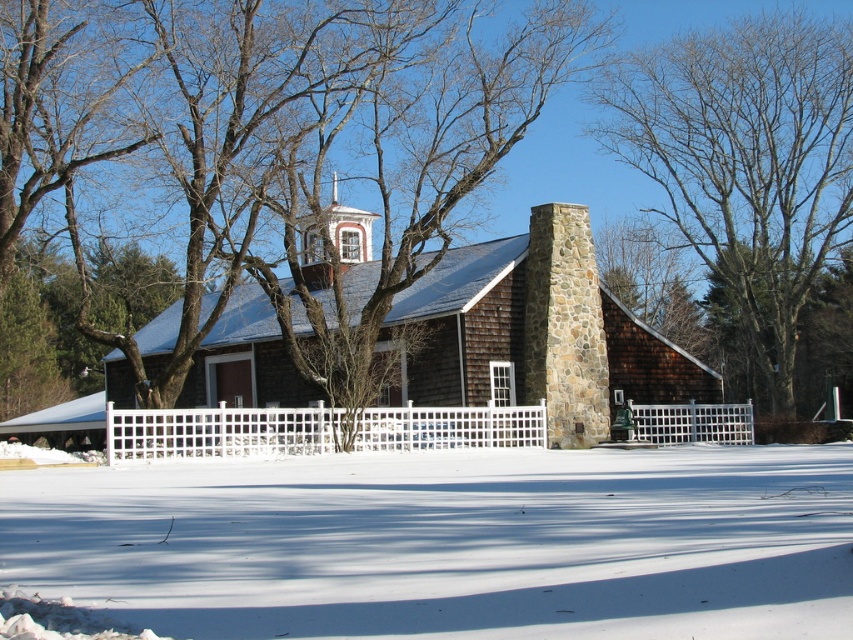
Question: Which of the following is the farthest from the observer?

Choices:
 (A) brown wooden church at center
 (B) bare branches at center

Answer: (B)

Question: Which point is closer to the camera?

Choices:
 (A) brown wooden church at center
 (B) white powdery snow at lower center
 (C) bare branches at center

Answer: (B)

Question: Can you confirm if white powdery snow at lower center is positioned to the left of bare branches at center?

Choices:
 (A) no
 (B) yes

Answer: (B)

Question: Is brown wooden church at center closer to camera compared to bare branches at center?

Choices:
 (A) no
 (B) yes

Answer: (B)

Question: From the image, what is the correct spatial relationship of brown wooden church at center in relation to bare branches at center?

Choices:
 (A) left
 (B) right

Answer: (A)

Question: Based on their relative distances, which object is farther from the brown wooden church at center?

Choices:
 (A) bare branches at center
 (B) white powdery snow at lower center

Answer: (A)